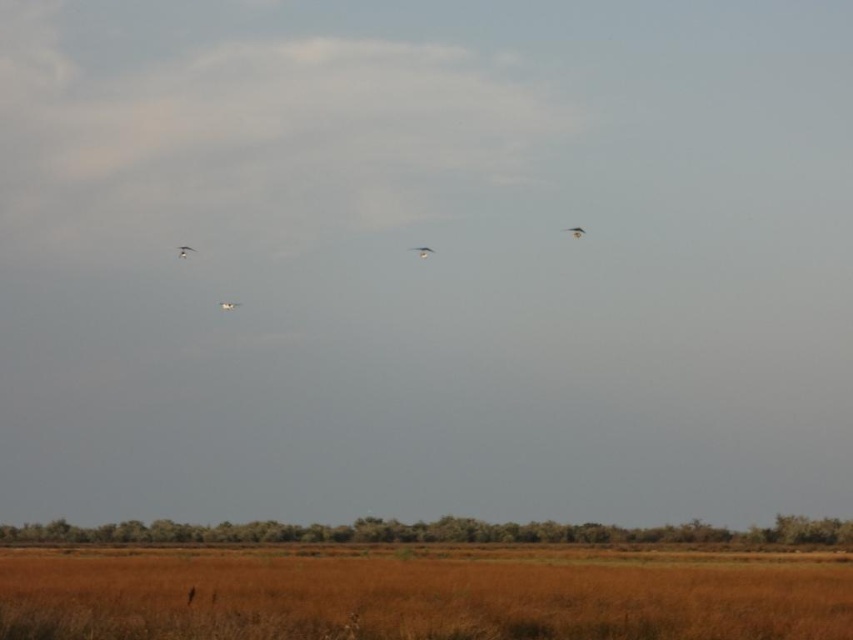
Is brown dry grass at lower center above smooth feathered bird at upper right?

Actually, brown dry grass at lower center is below smooth feathered bird at upper right.

Is point (770, 632) more distant than point (573, 227)?

No, (770, 632) is in front of (573, 227).

Find the location of a particular element. The width and height of the screenshot is (853, 640). brown dry grass at lower center is located at coordinates (422, 595).

Which of these two, brown dry grass at lower center or white glossy bird at upper center, stands shorter?

Standing shorter between the two is white glossy bird at upper center.

In the scene shown: Which is below, brown dry grass at lower center or white glossy bird at upper center?

brown dry grass at lower center

Measure the distance between point (529,577) and camera.

108.68 feet

The width and height of the screenshot is (853, 640). What are the coordinates of `brown dry grass at lower center` in the screenshot? It's located at (422, 595).

What do you see at coordinates (422, 595) in the screenshot? I see `brown dry grass at lower center` at bounding box center [422, 595].

Which is more to the left, brown dry grass at lower center or white feathered bird at center?

Positioned to the left is white feathered bird at center.

Is point (416, 552) positioned behind point (424, 253)?

No, (416, 552) is in front of (424, 253).

In order to click on brown dry grass at lower center in this screenshot , I will do `click(422, 595)`.